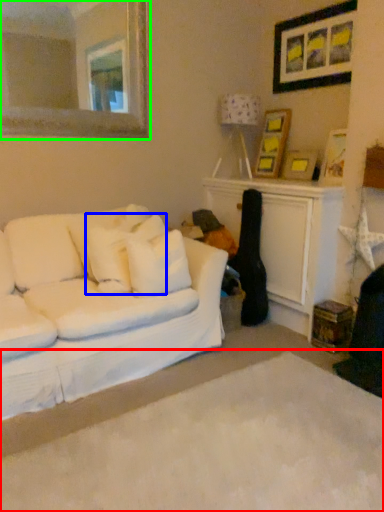
Question: Which is farther away from plain (highlighted by a red box)? pillow (highlighted by a blue box) or mirror (highlighted by a green box)?

Choices:
 (A) pillow
 (B) mirror

Answer: (B)